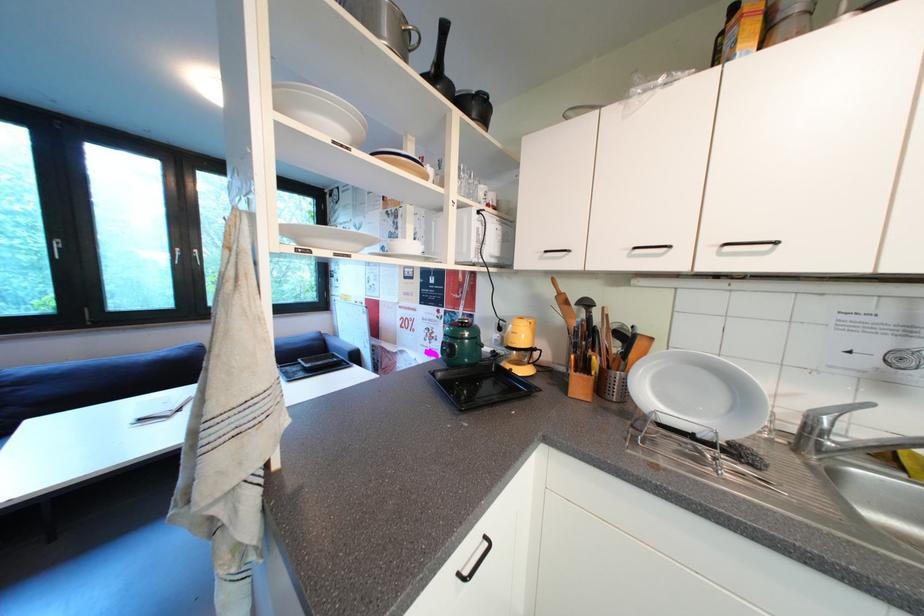
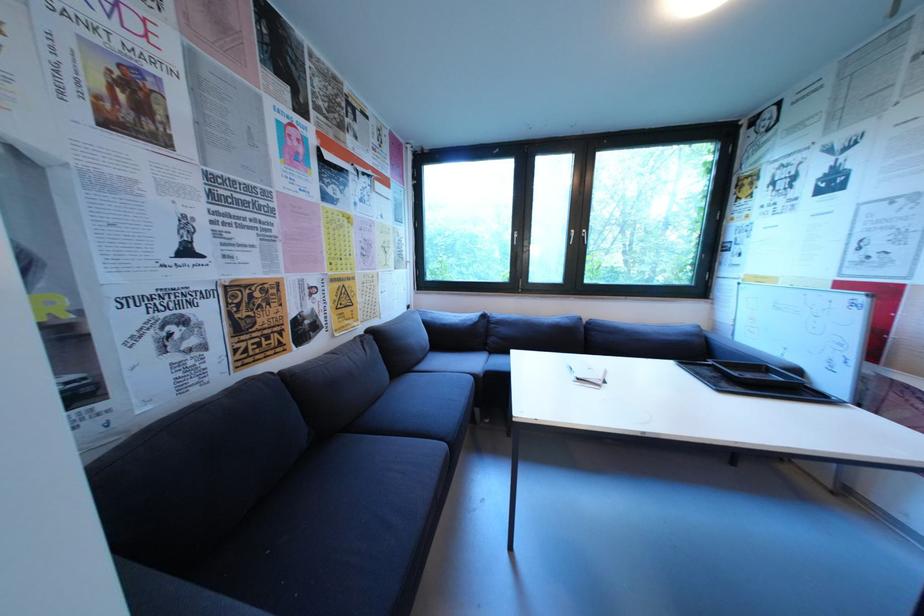
The point at (x=296, y=370) is marked in the first image. Where is the corresponding point in the second image?

(699, 369)